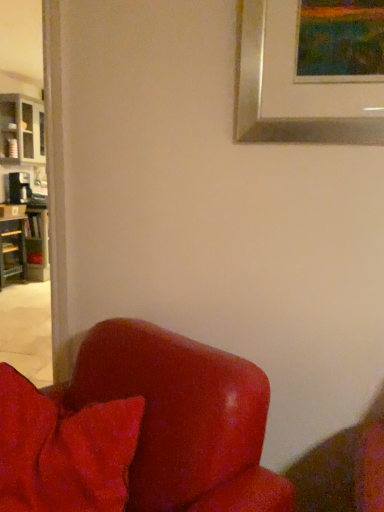
This screenshot has height=512, width=384. Find the location of `matte gray cabinet at left`. matte gray cabinet at left is located at coordinates [21, 130].

What is the approximate height of matte gray cabinet at left?

matte gray cabinet at left is 33.87 inches tall.

This screenshot has height=512, width=384. Describe the element at coordinates (12, 248) in the screenshot. I see `wooden bookshelf at left` at that location.

What do you see at coordinates (140, 430) in the screenshot?
I see `satin red armchair at lower left` at bounding box center [140, 430].

Where is `matte gray cabinet at left`? The width and height of the screenshot is (384, 512). matte gray cabinet at left is located at coordinates (21, 130).

Considering the sizes of wooden bookshelf at left and velvety red pillow at lower left in the image, is wooden bookshelf at left bigger or smaller than velvety red pillow at lower left?

In the image, wooden bookshelf at left appears to be larger than velvety red pillow at lower left.

From a real-world perspective, relative to velvety red pillow at lower left, is wooden bookshelf at left vertically above or below?

wooden bookshelf at left is situated lower than velvety red pillow at lower left in the real world.

Which point is more distant from viewer, (7, 278) or (13, 387)?

Positioned behind is point (7, 278).

How different are the orientations of wooden bookshelf at left and velvety red pillow at lower left in degrees?

96.7 degrees.

Is velvety red pillow at lower left wider or thinner than wooden bookshelf at left?

velvety red pillow at lower left is thinner than wooden bookshelf at left.

Is velvety red pillow at lower left in front of or behind wooden bookshelf at left in the image?

In the image, velvety red pillow at lower left appears in front of wooden bookshelf at left.

How many degrees apart are the facing directions of velvety red pillow at lower left and wooden bookshelf at left?

The angle between the facing direction of velvety red pillow at lower left and the facing direction of wooden bookshelf at left is 96.7 degrees.

Could you tell me if velvety red pillow at lower left is facing wooden bookshelf at left?

No, velvety red pillow at lower left is not aimed at wooden bookshelf at left.

Consider the image. Considering the relative sizes of wooden bookshelf at left and satin red armchair at lower left in the image provided, is wooden bookshelf at left bigger than satin red armchair at lower left?

No.

This screenshot has width=384, height=512. Find the location of `shelf on the left side of satin red armchair at lower left`. shelf on the left side of satin red armchair at lower left is located at coordinates (12, 248).

Considering the sizes of wooden bookshelf at left and satin red armchair at lower left in the image, is wooden bookshelf at left taller or shorter than satin red armchair at lower left?

wooden bookshelf at left is shorter than satin red armchair at lower left.

Can you tell me how much wooden bookshelf at left and satin red armchair at lower left differ in facing direction?

116 degrees.

Based on the photo, considering the relative sizes of matte gray cabinet at left and velvety red pillow at lower left in the image provided, is matte gray cabinet at left smaller than velvety red pillow at lower left?

Incorrect, matte gray cabinet at left is not smaller in size than velvety red pillow at lower left.

Which is less distant, (x=32, y=152) or (x=7, y=443)?

Point (x=32, y=152) is positioned farther from the camera compared to point (x=7, y=443).

Can you see matte gray cabinet at left touching velvety red pillow at lower left?

No, matte gray cabinet at left is not with velvety red pillow at lower left.

Locate an element on the screen. This screenshot has width=384, height=512. cabinetry above the velvety red pillow at lower left (from a real-world perspective) is located at coordinates (21, 130).

Is velvety red pillow at lower left looking in the opposite direction of satin red armchair at lower left?

That's right, velvety red pillow at lower left is facing away from satin red armchair at lower left.

Considering the relative positions of velvety red pillow at lower left and satin red armchair at lower left in the image provided, is velvety red pillow at lower left to the left of satin red armchair at lower left from the viewer's perspective?

Correct, you'll find velvety red pillow at lower left to the left of satin red armchair at lower left.

Looking at this image, who is bigger, velvety red pillow at lower left or satin red armchair at lower left?

satin red armchair at lower left is bigger.

Considering the positions of point (125, 485) and point (106, 437), is point (125, 485) closer or farther from the camera than point (106, 437)?

Point (125, 485) is farther from the camera than point (106, 437).

Which is correct: velvety red pillow at lower left is inside matte gray cabinet at left, or outside of it?

velvety red pillow at lower left is spatially situated outside matte gray cabinet at left.

Is velvety red pillow at lower left bigger than matte gray cabinet at left?

No.

Is velvety red pillow at lower left to the right of matte gray cabinet at left from the viewer's perspective?

Yes.

This screenshot has width=384, height=512. What are the coordinates of `pillow below the matte gray cabinet at left (from a real-world perspective)` in the screenshot? It's located at (63, 450).

Who is more distant, wooden bookshelf at left or matte gray cabinet at left?

matte gray cabinet at left is behind.

Who is smaller, wooden bookshelf at left or matte gray cabinet at left?

With smaller size is wooden bookshelf at left.

Measure the distance between wooden bookshelf at left and matte gray cabinet at left.

wooden bookshelf at left and matte gray cabinet at left are 4.11 feet apart from each other.

Considering the relative sizes of wooden bookshelf at left and matte gray cabinet at left in the image provided, is wooden bookshelf at left shorter than matte gray cabinet at left?

Indeed, wooden bookshelf at left has a lesser height compared to matte gray cabinet at left.

You are a GUI agent. You are given a task and a screenshot of the screen. Output one action in this format:
    pyautogui.click(x=<x>, y=<y>)
    Task: Click on the shelf that appears above the velvety red pillow at lower left (from the image's perspective)
    The height and width of the screenshot is (512, 384).
    Given the screenshot: What is the action you would take?
    pyautogui.click(x=12, y=248)

Where is `shelf on the left of velvety red pillow at lower left`? This screenshot has height=512, width=384. shelf on the left of velvety red pillow at lower left is located at coordinates (12, 248).

Which object lies nearer to the anchor point wooden bookshelf at left, velvety red pillow at lower left or matte gray cabinet at left?

Among the two, matte gray cabinet at left is located nearer to wooden bookshelf at left.

Looking at this image, which object lies nearer to the anchor point wooden bookshelf at left, matte gray cabinet at left or velvety red pillow at lower left?

Based on the image, matte gray cabinet at left appears to be nearer to wooden bookshelf at left.

Considering their positions, is satin red armchair at lower left positioned further to velvety red pillow at lower left than matte gray cabinet at left?

The object further to velvety red pillow at lower left is matte gray cabinet at left.

From the image, which object appears to be farther from velvety red pillow at lower left, satin red armchair at lower left or wooden bookshelf at left?

wooden bookshelf at left is further to velvety red pillow at lower left.

From the image, which object appears to be farther from wooden bookshelf at left, satin red armchair at lower left or matte gray cabinet at left?

satin red armchair at lower left is positioned further to the anchor wooden bookshelf at left.

Estimate the real-world distances between objects in this image. Which object is further from wooden bookshelf at left, satin red armchair at lower left or velvety red pillow at lower left?

satin red armchair at lower left.

Estimate the real-world distances between objects in this image. Which object is closer to wooden bookshelf at left, matte gray cabinet at left or satin red armchair at lower left?

matte gray cabinet at left lies closer to wooden bookshelf at left than the other object.

From the image, which object appears to be farther from matte gray cabinet at left, velvety red pillow at lower left or satin red armchair at lower left?

satin red armchair at lower left is further to matte gray cabinet at left.

Find the location of a particular element. pillow between satin red armchair at lower left and matte gray cabinet at left in the front-back direction is located at coordinates (63, 450).

At what (x,y) coordinates should I click in order to perform the action: click on shelf positioned between velvety red pillow at lower left and matte gray cabinet at left from near to far. Please return your answer as a coordinate pair (x, y). Looking at the image, I should click on tap(12, 248).

The width and height of the screenshot is (384, 512). In order to click on pillow between satin red armchair at lower left and wooden bookshelf at left from front to back in this screenshot , I will do `click(63, 450)`.

In order to click on shelf between satin red armchair at lower left and matte gray cabinet at left along the z-axis in this screenshot , I will do `click(12, 248)`.